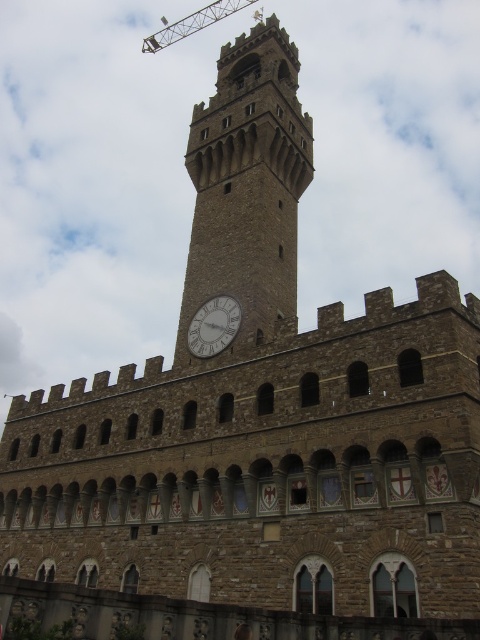
Question: Estimate the real-world distances between objects in this image. Which object is farther from the metallic construction crane at upper center?

Choices:
 (A) stone clock tower at center
 (B) white stone clock at center

Answer: (B)

Question: Is stone clock tower at center smaller than metallic construction crane at upper center?

Choices:
 (A) no
 (B) yes

Answer: (B)

Question: Is stone clock tower at center closer to camera compared to white stone clock at center?

Choices:
 (A) no
 (B) yes

Answer: (B)

Question: Considering the real-world distances, which object is farthest from the stone clock tower at center?

Choices:
 (A) white stone clock at center
 (B) metallic construction crane at upper center

Answer: (B)

Question: Is white stone clock at center wider than metallic construction crane at upper center?

Choices:
 (A) yes
 (B) no

Answer: (B)

Question: Which object appears closest to the camera in this image?

Choices:
 (A) metallic construction crane at upper center
 (B) stone clock tower at center

Answer: (B)